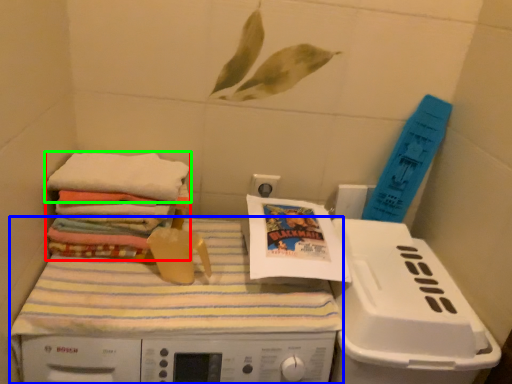
Question: Which is nearer to the material (highlighted by a red box)? machine (highlighted by a blue box) or towel (highlighted by a green box).

Choices:
 (A) machine
 (B) towel

Answer: (B)